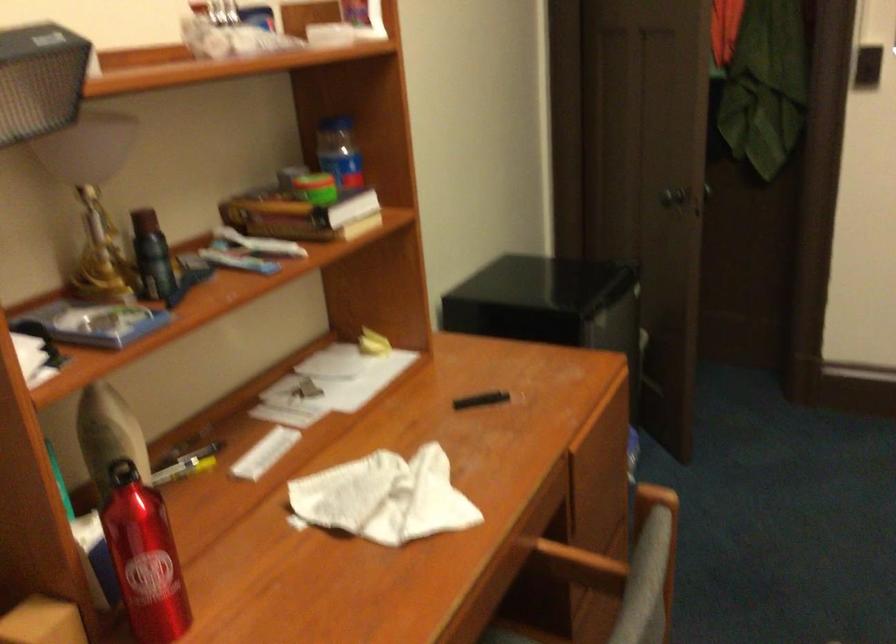
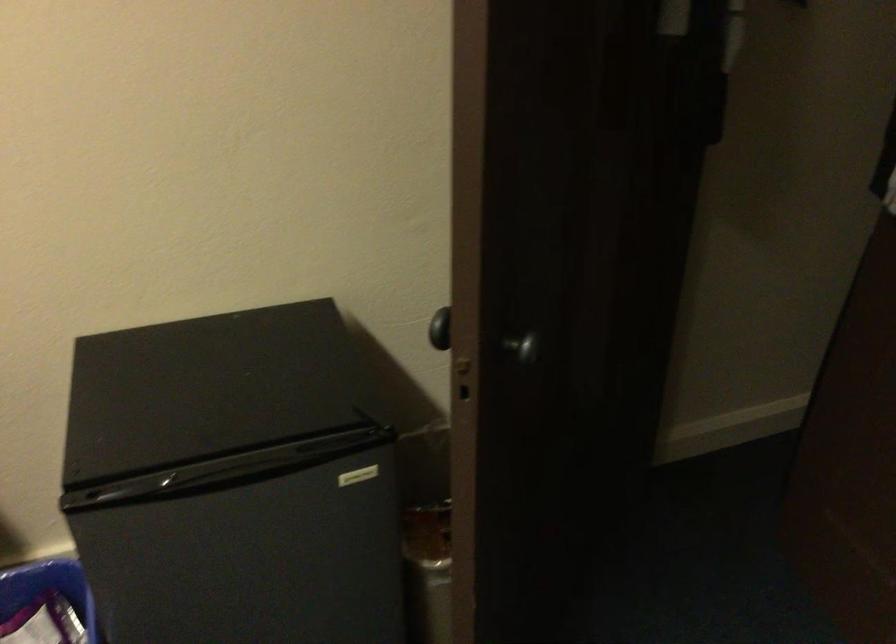
The point at (x=675, y=193) is marked in the first image. Where is the corresponding point in the second image?

(440, 328)